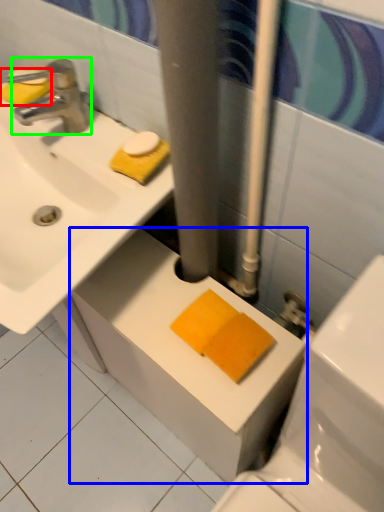
Question: Which is nearer to the soap (highlighted by a red box)? counter top (highlighted by a blue box) or tap (highlighted by a green box).

Choices:
 (A) counter top
 (B) tap

Answer: (B)